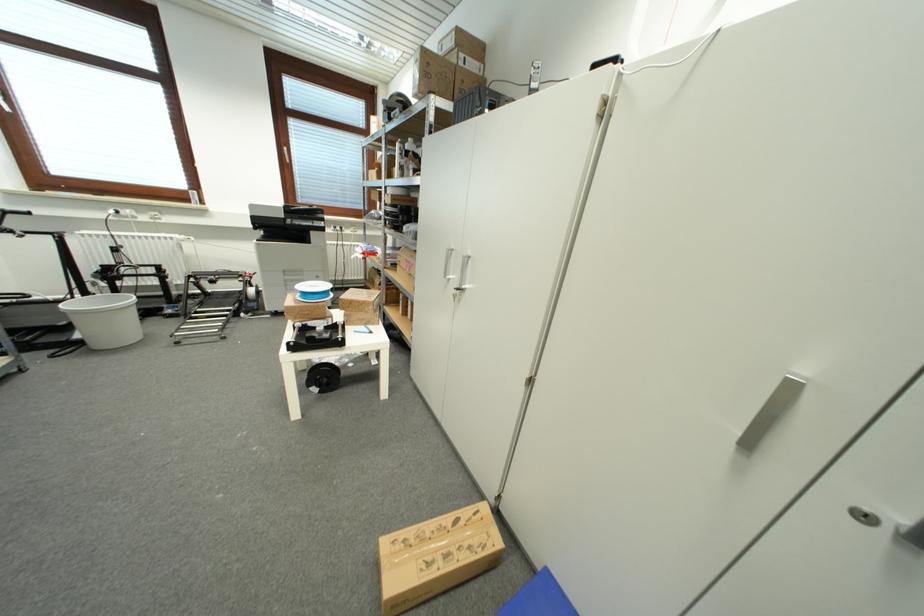
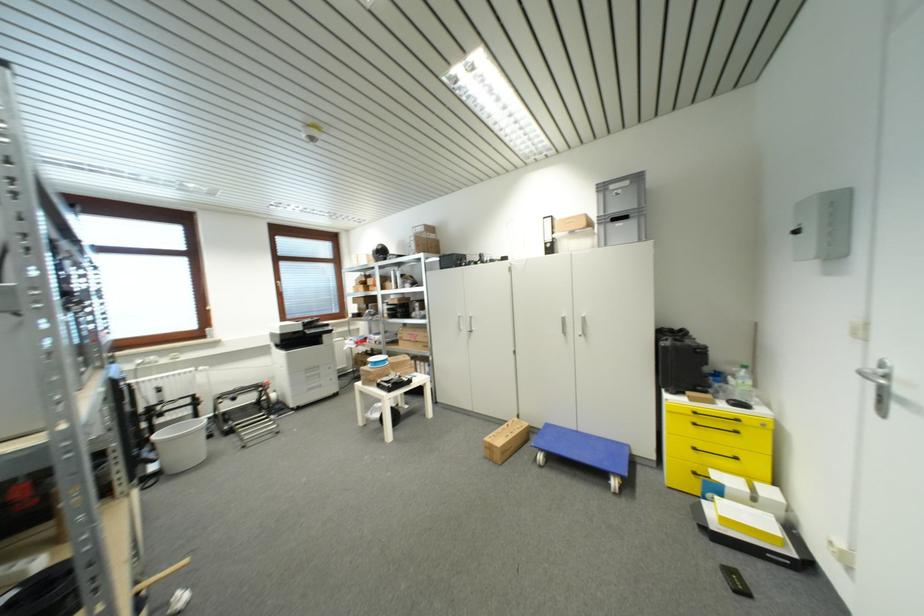
Locate, in the second image, the point that corresponds to pixel 101 346 in the first image.

(177, 472)